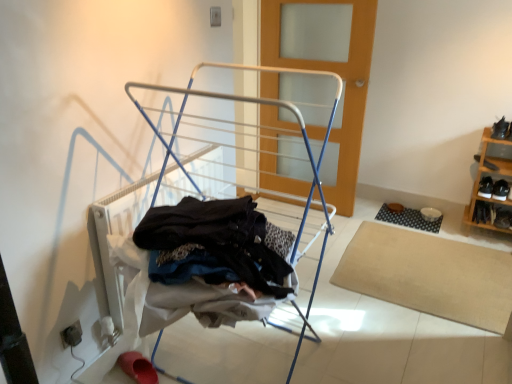
Identify the location of free point above black rubber mat at lower right, which ranks as the second mat in front-to-back order (from a real-world perspective). (410, 210).